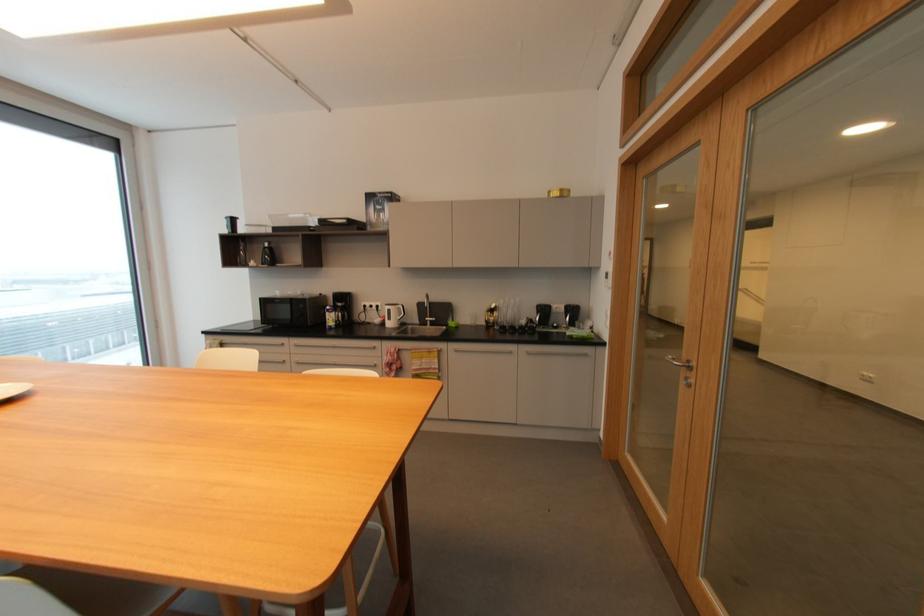
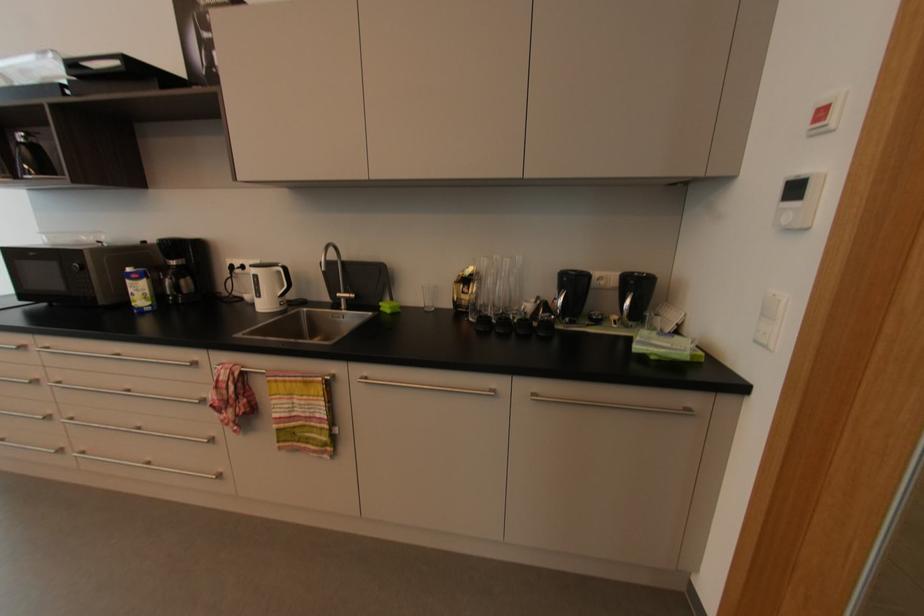
In the second image, find the point that corresponds to pixel 610 328 in the first image.

(769, 347)